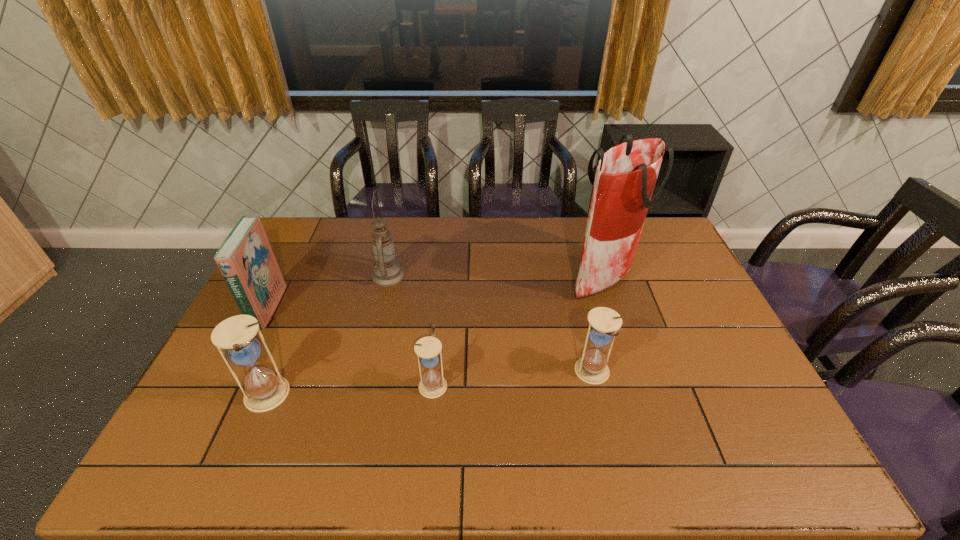
In order to click on blank space located 0.360m on the left of the third object from right to left in this screenshot , I will do `click(282, 384)`.

Where is `vacant space located 0.050m on the left of the fifth tallest object`? Image resolution: width=960 pixels, height=540 pixels. vacant space located 0.050m on the left of the fifth tallest object is located at coordinates (557, 373).

Identify the location of free space located on the right of the oil lamp. The width and height of the screenshot is (960, 540). (502, 276).

Locate an element on the screen. free space located on the front of the grocery bag is located at coordinates (632, 366).

At what (x,y) coordinates should I click in order to perform the action: click on free space located on the cover of the hardback book. Please return your answer as a coordinate pair (x, y). This screenshot has height=540, width=960. Looking at the image, I should click on (376, 308).

What are the coordinates of `hourglass at the left edge` in the screenshot? It's located at (264, 390).

Locate an element on the screen. The height and width of the screenshot is (540, 960). hardback book that is at the left edge is located at coordinates (246, 260).

You are a GUI agent. You are given a task and a screenshot of the screen. Output one action in this format:
    pyautogui.click(x=<x>, y=<y>)
    Task: Click on the object that is at the near left corner
    
    Given the screenshot: What is the action you would take?
    tap(264, 390)

Find the location of a particular element. This screenshot has width=960, height=540. vacant region at the far edge of the desktop is located at coordinates (565, 217).

Locate an element on the screen. Image resolution: width=960 pixels, height=540 pixels. vacant area at the near edge of the desktop is located at coordinates (368, 417).